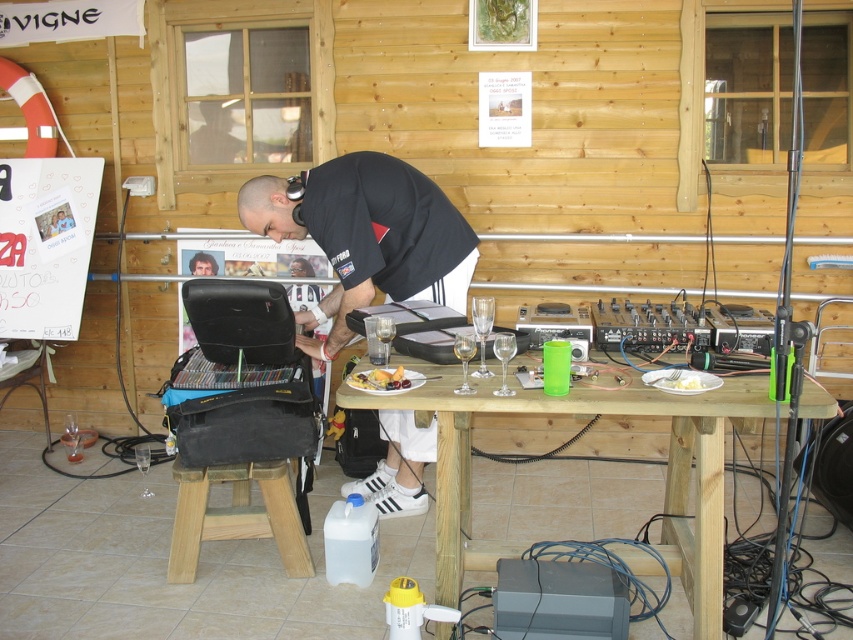
Is wooden table at center below smooth yellow cake at center?

Yes, wooden table at center is below smooth yellow cake at center.

Between wooden table at center and smooth yellow cake at center, which one is positioned lower?

wooden table at center is below.

Does point (514, 544) come in front of point (374, 384)?

No, it is not.

Where is `wooden table at center`? This screenshot has height=640, width=853. wooden table at center is located at coordinates (581, 417).

Who is more forward, (x=698, y=556) or (x=693, y=381)?

Positioned in front is point (x=693, y=381).

Is point (439, 401) positioned after point (683, 380)?

No.

Is point (535, 401) in front of point (682, 378)?

Yes, point (535, 401) is closer to viewer.

Locate an element on the screen. This screenshot has height=640, width=853. wooden table at center is located at coordinates (581, 417).

Does wooden table at center come in front of black matte shirt at center?

Yes.

Does wooden table at center appear on the left side of black matte shirt at center?

In fact, wooden table at center is to the right of black matte shirt at center.

Does point (695, 492) come behind point (251, 193)?

No, (695, 492) is in front of (251, 193).

Locate an element on the screen. This screenshot has width=853, height=640. wooden table at center is located at coordinates (581, 417).